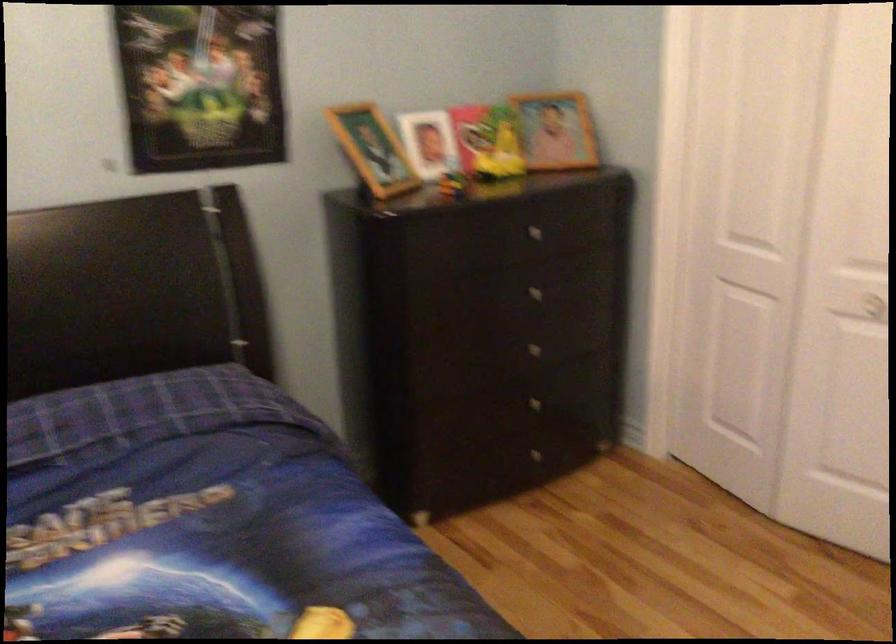
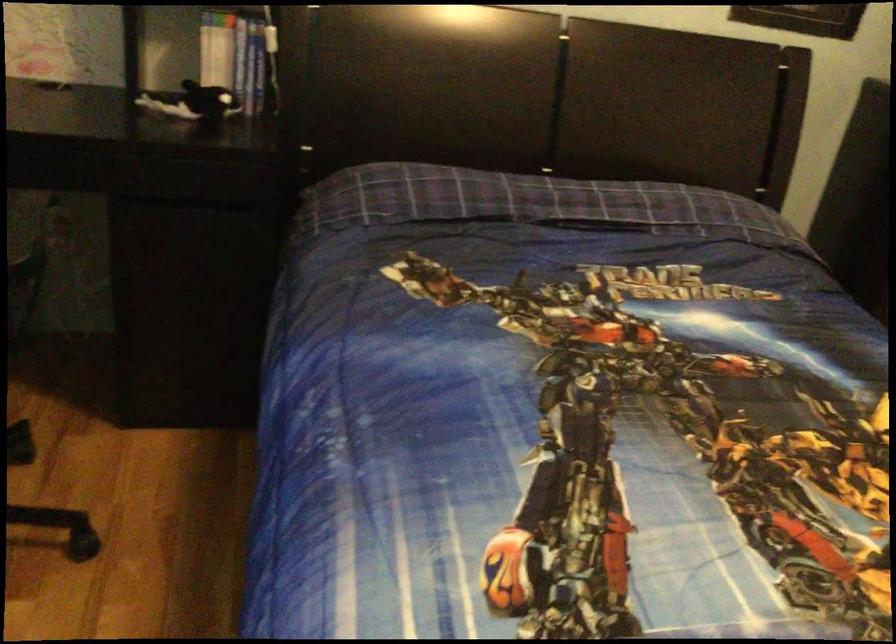
Question: The camera is either moving clockwise (left) or counter-clockwise (right) around the object. The first image is from the beginning of the video and the second image is from the end. Is the camera moving left or right when shooting the video?

Choices:
 (A) Left
 (B) Right

Answer: (B)